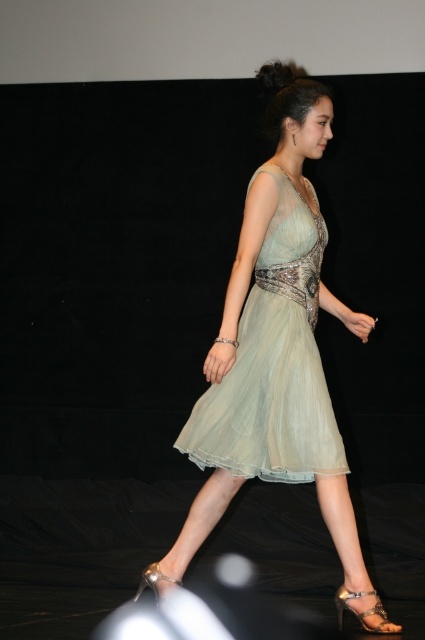
You are a fashion designer observing a model wearing the light green sheer dress at center and the satin gold sandal at lower center. You need to ensure the dress doesn not drag on the runway. Based on their sizes, which item has a wider width?

The light green sheer dress at center has a larger width than the satin gold sandal at lower center, so the dress is wider.